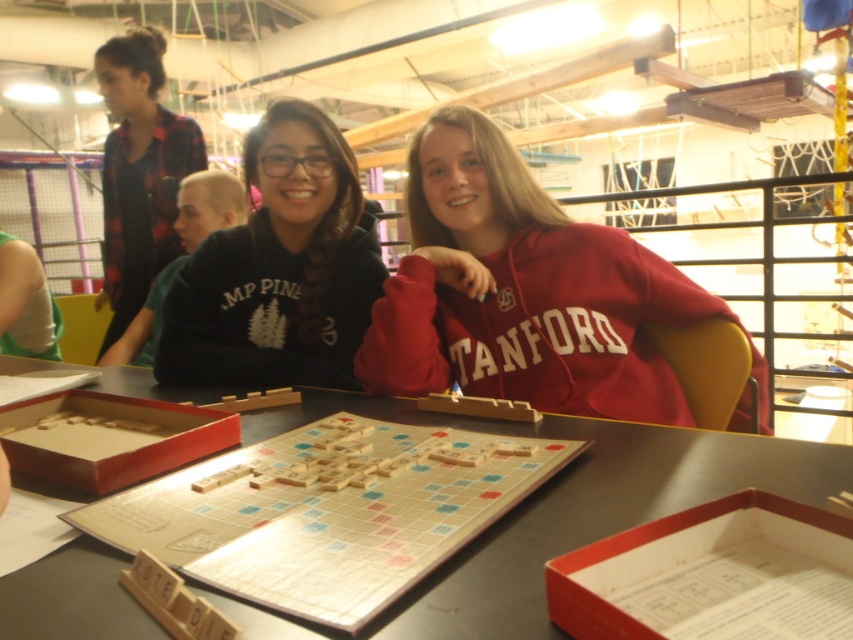
Is the position of red matte stanford hoodie at center less distant than that of wooden scrabble board at center?

No, it is behind wooden scrabble board at center.

Can you confirm if red matte stanford hoodie at center is taller than wooden scrabble board at center?

Correct, red matte stanford hoodie at center is much taller as wooden scrabble board at center.

Which is behind, point (465, 168) or point (421, 589)?

Point (465, 168)

Find the location of a particular element. Image resolution: width=853 pixels, height=640 pixels. red matte stanford hoodie at center is located at coordinates (521, 291).

In the scene shown: Is wooden scrabble board at center above black matte sweatshirt at center?

No, wooden scrabble board at center is not above black matte sweatshirt at center.

Can you confirm if wooden scrabble board at center is positioned below black matte sweatshirt at center?

Yes, wooden scrabble board at center is below black matte sweatshirt at center.

This screenshot has height=640, width=853. What are the coordinates of `wooden scrabble board at center` in the screenshot? It's located at tap(550, 512).

At what (x,y) coordinates should I click in order to perform the action: click on wooden scrabble board at center. Please return your answer as a coordinate pair (x, y). Looking at the image, I should click on (550, 512).

Is red matte stanford hoodie at center wider than black matte sweatshirt at center?

Correct, the width of red matte stanford hoodie at center exceeds that of black matte sweatshirt at center.

Is red matte stanford hoodie at center positioned in front of black matte sweatshirt at center?

Yes, red matte stanford hoodie at center is closer to the viewer.

Locate an element on the screen. This screenshot has height=640, width=853. red matte stanford hoodie at center is located at coordinates (521, 291).